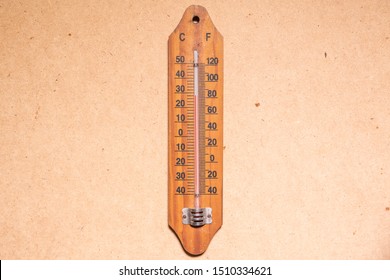
Find the location of a particular element. The height and width of the screenshot is (280, 390). glass is located at coordinates (198, 203), (198, 56).